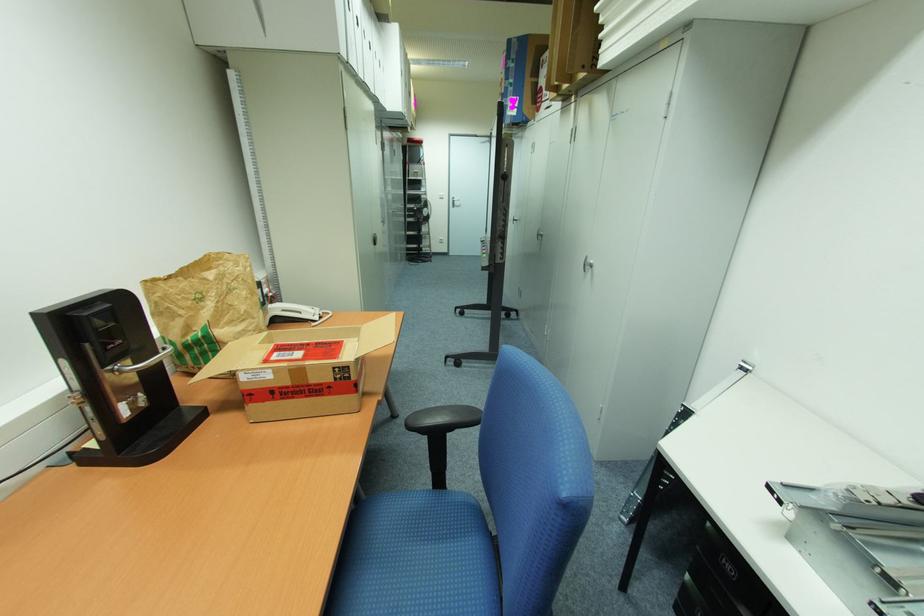
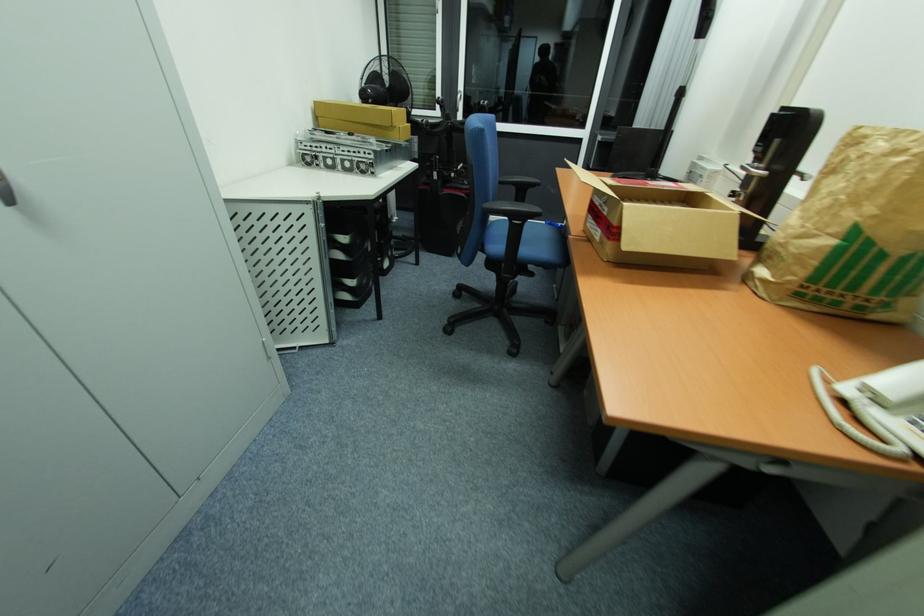
Locate, in the second image, the point that corresponds to [238,270] in the first image.

(880, 147)